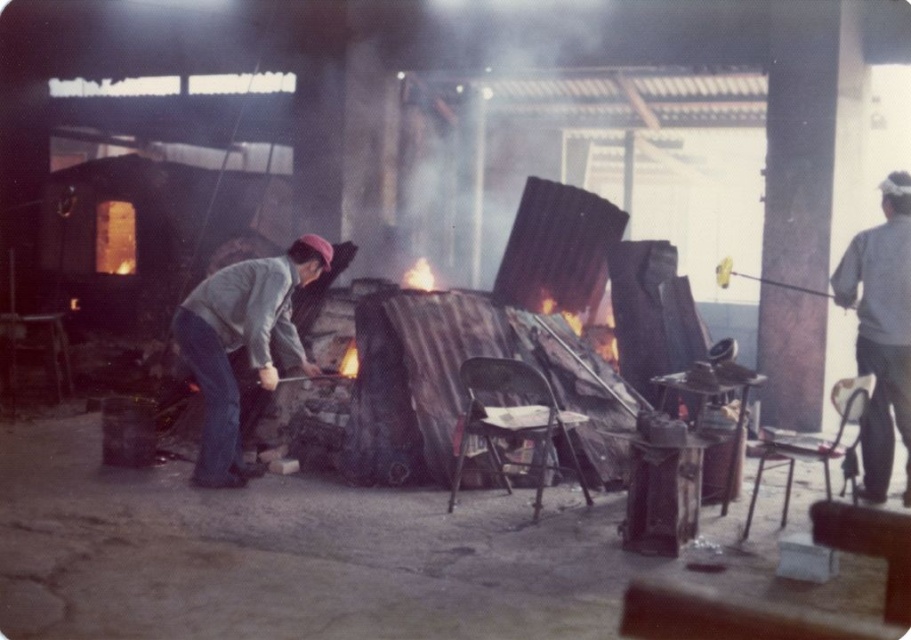
Between point (305, 272) and point (875, 486), which one is positioned in front?

Point (875, 486) is in front.

What do you see at coordinates (241, 342) in the screenshot? I see `gray fabric jacket at center` at bounding box center [241, 342].

Is point (323, 268) positioned in front of point (860, 285)?

No, it is not.

Locate an element on the screen. The height and width of the screenshot is (640, 911). gray fabric jacket at center is located at coordinates (241, 342).